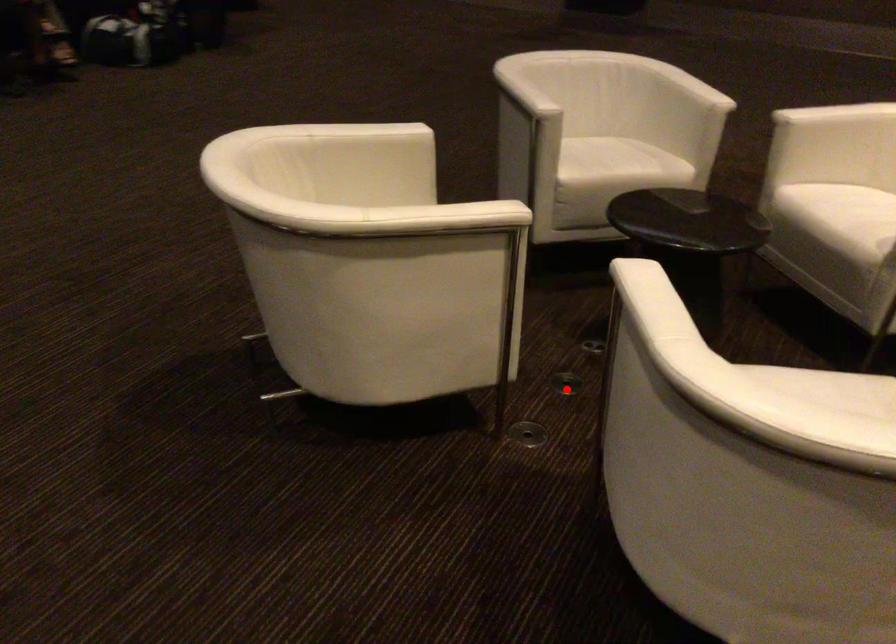
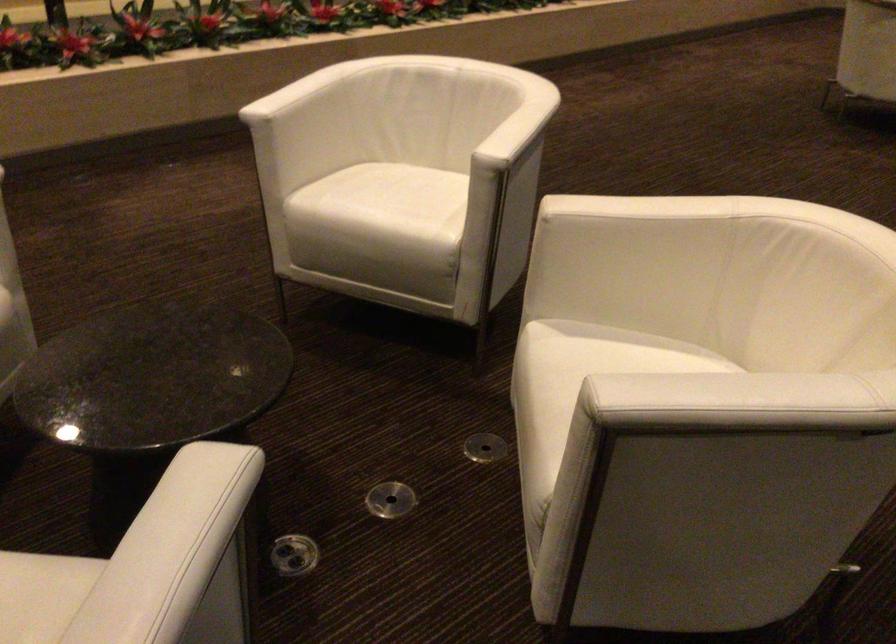
Question: I am providing you with two images of the same scene from different viewpoints. A red point is shown in image1. For the corresponding object point in image2, is it positioned nearer or farther from the camera?

Choices:
 (A) Nearer
 (B) Farther

Answer: (A)